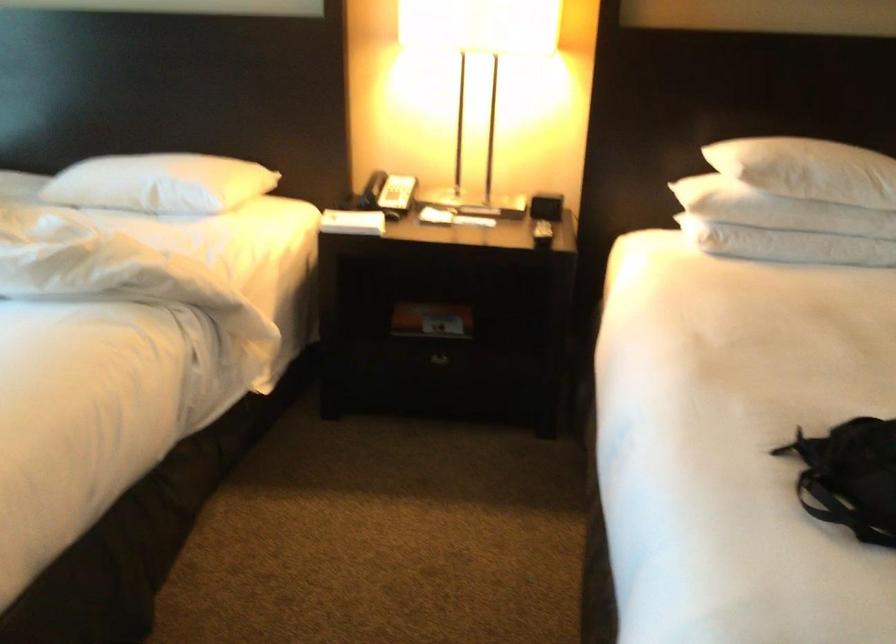
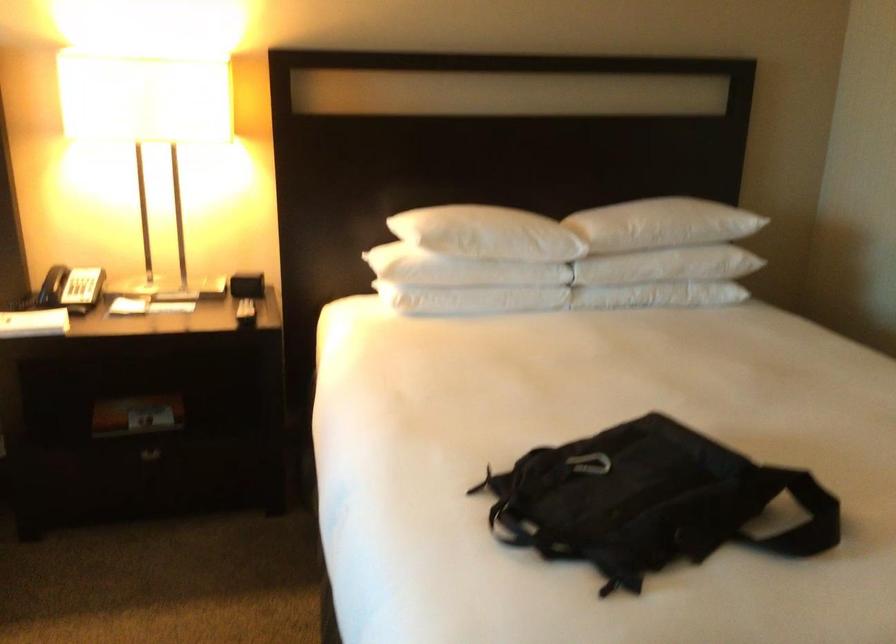
The point at (442, 362) is marked in the first image. Where is the corresponding point in the second image?

(151, 456)